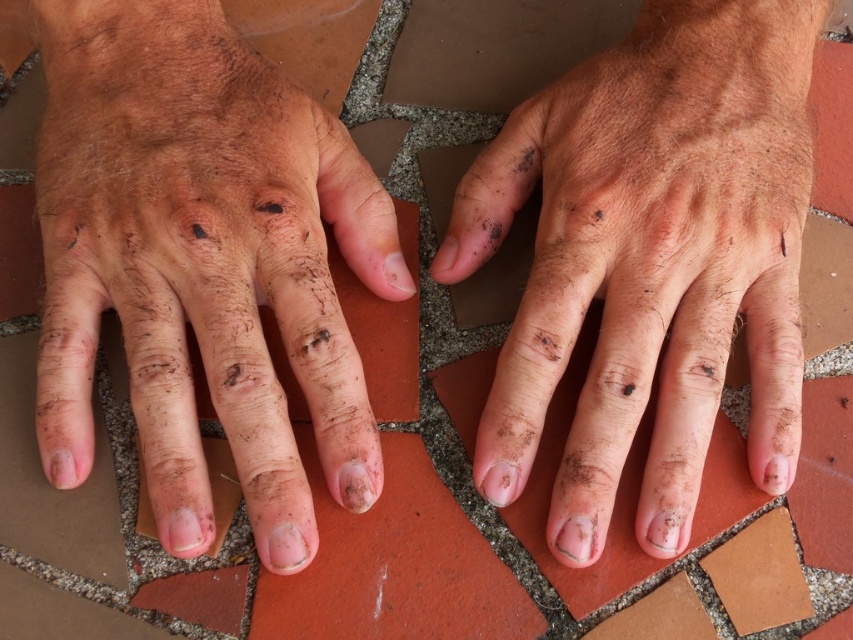
Question: Among these objects, which one is nearest to the camera?

Choices:
 (A) dry skin at center
 (B) dirty skin hand at center

Answer: (A)

Question: Which object is closer to the camera taking this photo?

Choices:
 (A) dry skin at center
 (B) dirty skin hand at center

Answer: (A)

Question: Which object is farther from the camera taking this photo?

Choices:
 (A) dirty skin hand at center
 (B) dry skin at center

Answer: (A)

Question: Is dry skin at center wider than dirty skin hand at center?

Choices:
 (A) yes
 (B) no

Answer: (B)

Question: Is dry skin at center above dirty skin hand at center?

Choices:
 (A) yes
 (B) no

Answer: (B)

Question: Can you confirm if dry skin at center is positioned to the left of dirty skin hand at center?

Choices:
 (A) yes
 (B) no

Answer: (A)